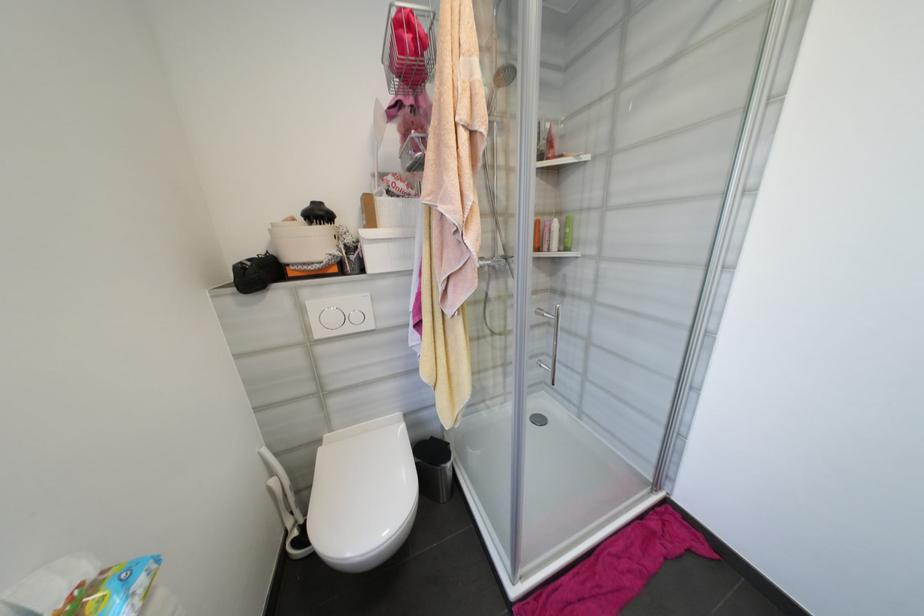
Where would you squeez the white bottle? Please return your answer as a coordinate pair (x, y).

(553, 235)